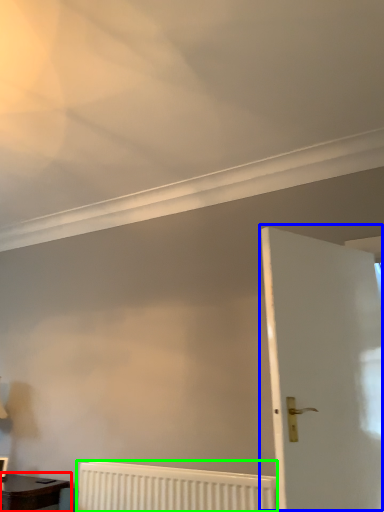
Question: Based on their relative distances, which object is farther from table (highlighted by a red box)? Choose from door (highlighted by a blue box) and radiator (highlighted by a green box).

Choices:
 (A) door
 (B) radiator

Answer: (A)